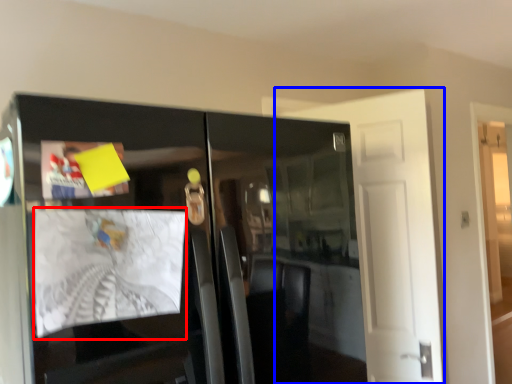
Question: Among these objects, which one is nearest to the camera, magazine (highlighted by a red box) or door (highlighted by a blue box)?

Choices:
 (A) magazine
 (B) door

Answer: (A)